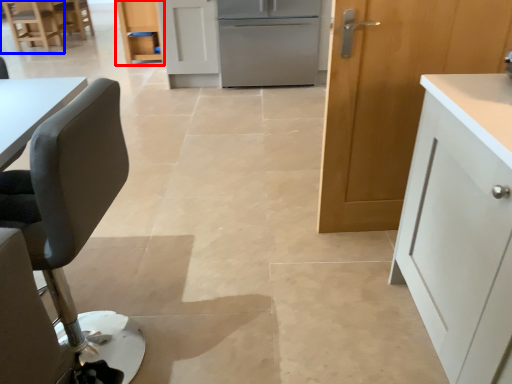
Question: Which point is closer to the camera, cabinetry (highlighted by a red box) or chair (highlighted by a blue box)?

Choices:
 (A) cabinetry
 (B) chair

Answer: (A)